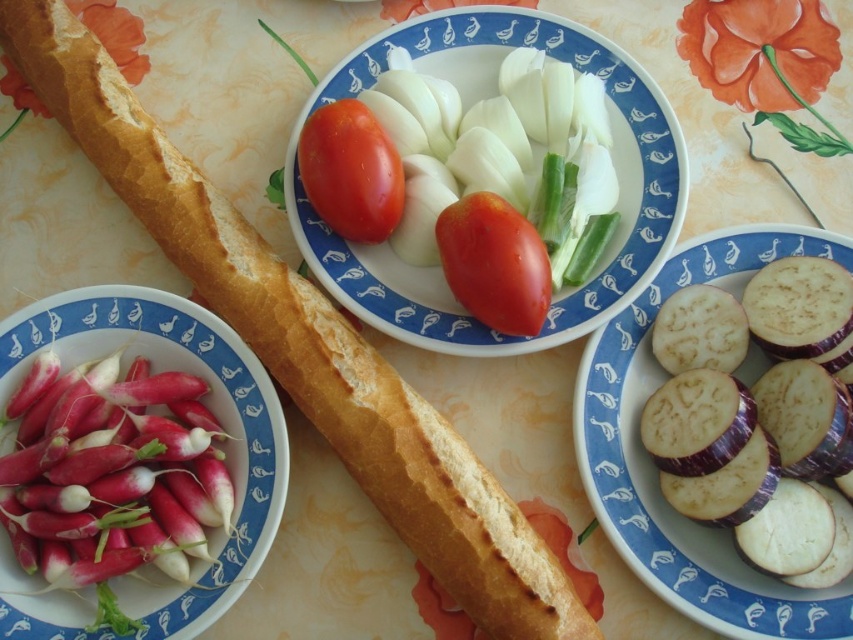
Question: Does sliced purple eggplant at center have a greater width compared to glossy red tomato at center?

Choices:
 (A) yes
 (B) no

Answer: (A)

Question: Which point is farther from the camera taking this photo?

Choices:
 (A) (711, 544)
 (B) (444, 573)
 (C) (213, 387)

Answer: (C)

Question: Considering the real-world distances, which object is farthest from the sliced purple eggplant at center?

Choices:
 (A) red glossy tomatoes at center
 (B) golden crusty baguette at center
 (C) shiny red tomato at center

Answer: (B)

Question: Can you confirm if sliced purple eggplant at center is positioned to the left of red radish at left?

Choices:
 (A) no
 (B) yes

Answer: (A)

Question: Which of the following is the closest to the observer?

Choices:
 (A) [x=352, y=108]
 (B) [x=479, y=275]
 (C) [x=839, y=244]
 (D) [x=45, y=339]

Answer: (B)

Question: In this image, where is red glossy tomatoes at center located relative to glossy red tomato at center?

Choices:
 (A) right
 (B) left

Answer: (A)